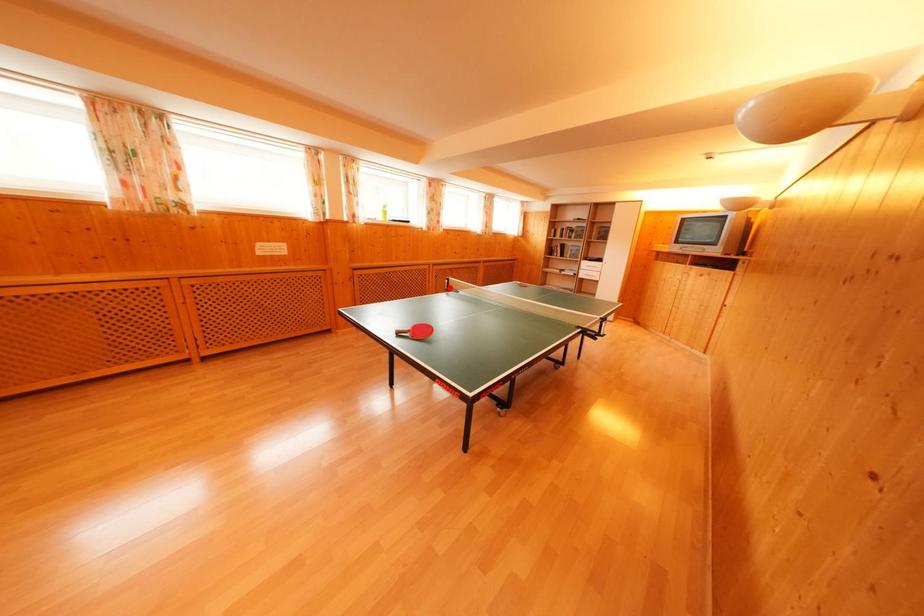
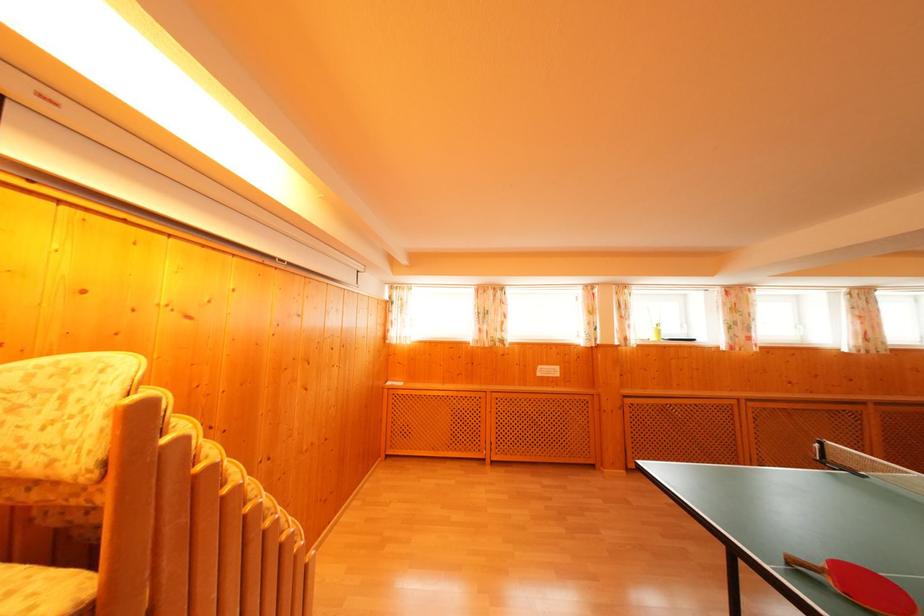
Question: I am providing you with two images of the same scene from different viewpoints. Given a red point in image1, look at the same physical point in image2. Is it:

Choices:
 (A) Closer to the viewpoint
 (B) Farther from the viewpoint

Answer: (A)